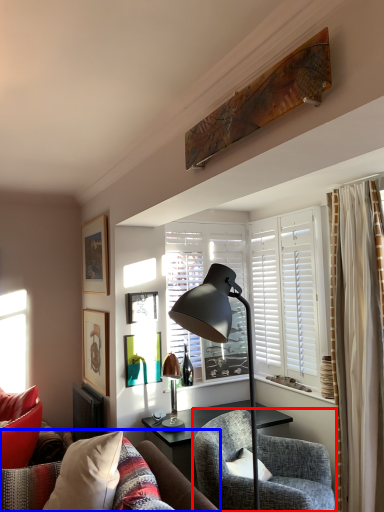
Question: Which object appears farthest to the camera in this image, chair (highlighted by a red box) or studio couch (highlighted by a blue box)?

Choices:
 (A) chair
 (B) studio couch

Answer: (A)